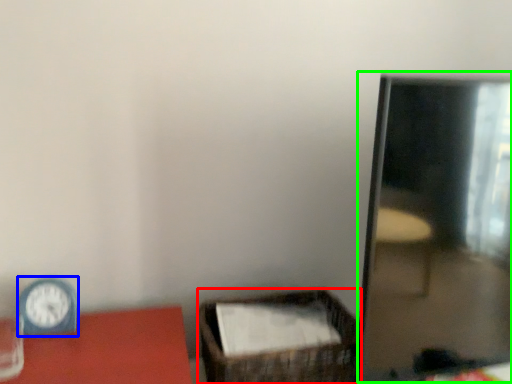
Question: Considering the real-world distances, which object is farthest from basket (highlighted by a red box)? clock (highlighted by a blue box) or mirror (highlighted by a green box)?

Choices:
 (A) clock
 (B) mirror

Answer: (A)